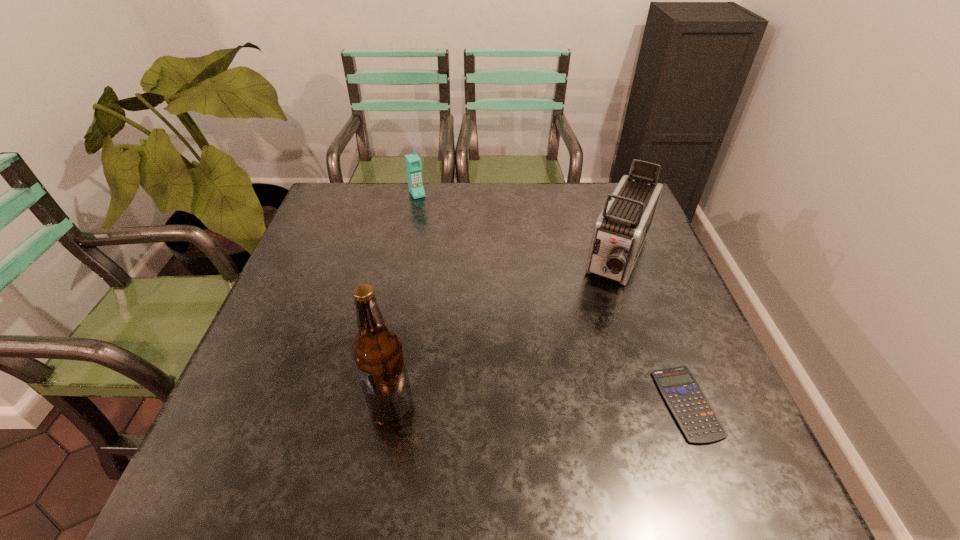
Identify which object is the second nearest to the shortest object. Please provide its 2D coordinates. Your answer should be formatted as a tuple, i.e. [(x, y)], where the tuple contains the x and y coordinates of a point satisfying the conditions above.

[(377, 350)]

The width and height of the screenshot is (960, 540). Find the location of `free space that satisfies the following two spatial constraints: 1. on the front side of the shortest object; 2. on the right side of the farthest object`. free space that satisfies the following two spatial constraints: 1. on the front side of the shortest object; 2. on the right side of the farthest object is located at coordinates (377, 403).

Where is `free space that satisfies the following two spatial constraints: 1. on the front side of the farthest object; 2. on the label of the tallest object`? The width and height of the screenshot is (960, 540). free space that satisfies the following two spatial constraints: 1. on the front side of the farthest object; 2. on the label of the tallest object is located at coordinates (377, 405).